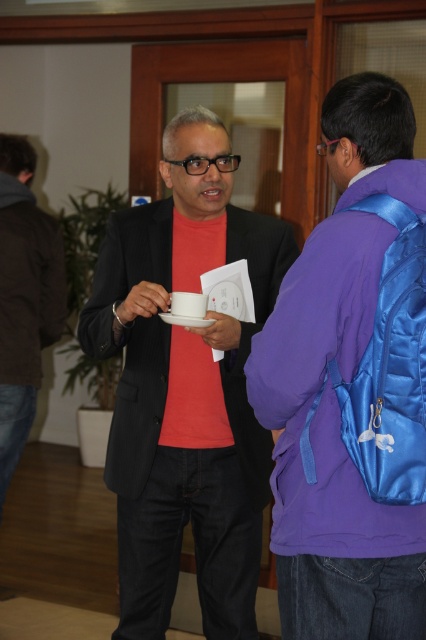
Consider the image. You are organizing a meeting and want to seat the attendees according to their positions. The person in the matte black suit at center is a senior manager, and the person in the brown leather jacket at left is a junior employee. Based on their positions in the image, which side should you place the senior manager to indicate hierarchy?

The matte black suit at center is positioned on the right side of brown leather jacket at left, so to follow the hierarchy, the senior manager should be placed to the right side of the junior employee.

You are standing at the entrance of the room and want to approach the person wearing the matte black jacket at center. Which direction should you move to reach them?

The matte black jacket at center is located at point coordinates, so you should move towards the center of the room to reach them.

You are standing in the conference room and need to hand a document to the person wearing the matte black jacket at center. The document is on the table 3 feet away from you. Can you reach them without moving from your current position?

The matte black jacket at center is 4.81 feet away from the camera, which is farther than the 3 feet distance to the document. Therefore, you cannot reach them without moving.